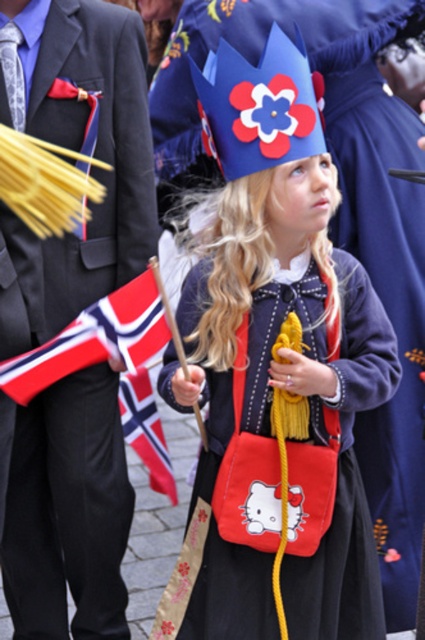
Please describe the exact location of the matte blue crown at center in terms of coordinates. The image has a coordinate system where the bottom left corner is the origin point. The horizontal axis is the x axis, and the vertical axis is the y axis. The top right corner is the point with the highest x and y values. The coordinates are normalized between 0 and 1. Please provide the coordinates as a pair of numbers between 0 and 1, separated by a comma. The answer should be in the format of a pair of numbers,

The matte blue crown at center is located at coordinates (274, 376).

Based on the photo, the girl is holding a flag and wearing a crown. Which object is bigger in size between the matte blue crown at center and the red and white fabric flag at lower left?

The matte blue crown at center is larger in size compared to the red and white fabric flag at lower left.

You are a photographer at the event and want to capture a clear shot of both the matte blue crown at center and the matte black suit at left. Given their height difference, which object will appear larger in the photo?

The matte blue crown at center is much taller than the matte black suit at left, so it will appear larger in the photo.